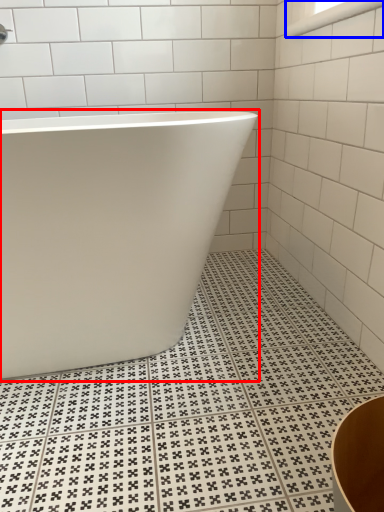
Question: Among these objects, which one is farthest to the camera, bathtub (highlighted by a red box) or window (highlighted by a blue box)?

Choices:
 (A) bathtub
 (B) window

Answer: (B)